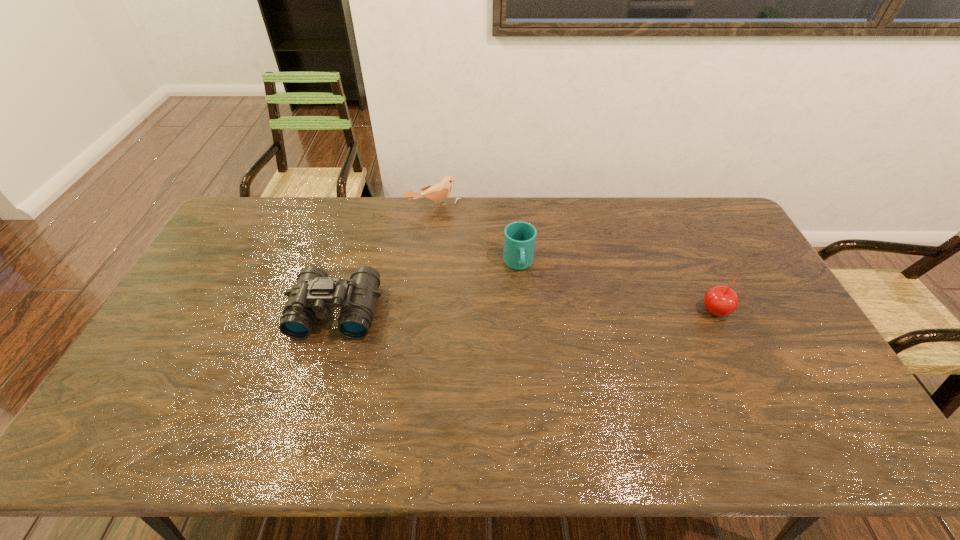
Locate an element on the screen. This screenshot has width=960, height=540. object that is the closest to the bird is located at coordinates (519, 237).

Identify which object is the third closest to the bird. Please provide its 2D coordinates. Your answer should be formatted as a tuple, i.e. [(x, y)], where the tuple contains the x and y coordinates of a point satisfying the conditions above.

[(720, 300)]

Find the location of a particular element. The width and height of the screenshot is (960, 540). vacant space that satisfies the following two spatial constraints: 1. through the lenses of the binoculars; 2. on the left side of the rightmost object is located at coordinates (336, 311).

Find the location of a particular element. The width and height of the screenshot is (960, 540). free space that satisfies the following two spatial constraints: 1. on the front side of the cup; 2. on the right side of the rightmost object is located at coordinates (522, 311).

Locate an element on the screen. vacant region that satisfies the following two spatial constraints: 1. through the lenses of the leftmost object; 2. on the right side of the cherry is located at coordinates (336, 311).